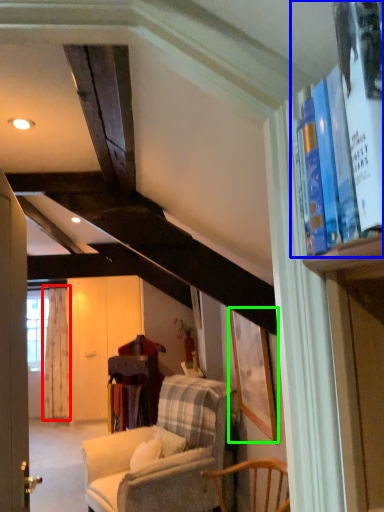
Question: Which object is positioned farthest from curtain (highlighted by a red box)? Select from book (highlighted by a blue box) and picture frame (highlighted by a green box).

Choices:
 (A) book
 (B) picture frame

Answer: (A)